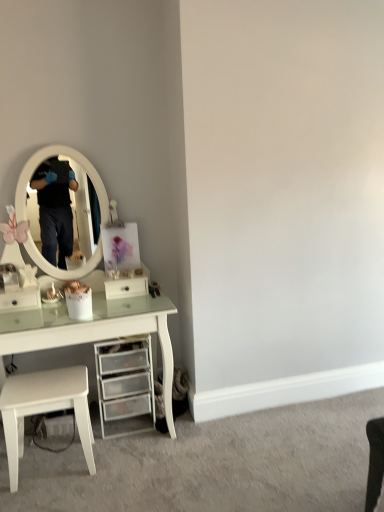
Question: Can you confirm if white glossy drawer at center, the 1th drawer positioned from the right, is thinner than clear plastic drawers at lower center?

Choices:
 (A) no
 (B) yes

Answer: (B)

Question: From a real-world perspective, is white glossy drawer at center, marked as the second drawer in a left-to-right arrangement, under clear plastic drawers at lower center?

Choices:
 (A) yes
 (B) no

Answer: (B)

Question: Considering the relative positions of white glossy drawer at center, marked as the second drawer in a left-to-right arrangement, and clear plastic drawers at lower center in the image provided, is white glossy drawer at center, marked as the second drawer in a left-to-right arrangement, in front of clear plastic drawers at lower center?

Choices:
 (A) yes
 (B) no

Answer: (B)

Question: Is clear plastic drawers at lower center at the back of white glossy drawer at center, the 1th drawer positioned from the right?

Choices:
 (A) yes
 (B) no

Answer: (B)

Question: Is white glossy drawer at center, marked as the second drawer in a left-to-right arrangement, not inside clear plastic drawers at lower center?

Choices:
 (A) no
 (B) yes

Answer: (B)

Question: Choose the correct answer: Is clear plastic drawers at lower center inside white matte stool at lower left or outside it?

Choices:
 (A) outside
 (B) inside

Answer: (A)

Question: From the image's perspective, relative to white matte stool at lower left, is clear plastic drawers at lower center above or below?

Choices:
 (A) below
 (B) above

Answer: (B)

Question: In terms of size, does clear plastic drawers at lower center appear bigger or smaller than white matte stool at lower left?

Choices:
 (A) small
 (B) big

Answer: (B)

Question: In terms of height, does clear plastic drawers at lower center look taller or shorter compared to white matte stool at lower left?

Choices:
 (A) short
 (B) tall

Answer: (B)

Question: Would you say white glossy drawer at left, which is the first drawer in left-to-right order, is inside or outside white glossy drawer at center, the 1th drawer positioned from the right?

Choices:
 (A) inside
 (B) outside

Answer: (B)

Question: Based on their sizes in the image, would you say white glossy drawer at left, which appears as the 2th drawer when viewed from the right, is bigger or smaller than white glossy drawer at center, marked as the second drawer in a left-to-right arrangement?

Choices:
 (A) small
 (B) big

Answer: (B)

Question: Considering the positions of white glossy drawer at left, which appears as the 2th drawer when viewed from the right, and white glossy drawer at center, the 1th drawer positioned from the right, in the image, is white glossy drawer at left, which appears as the 2th drawer when viewed from the right, taller or shorter than white glossy drawer at center, the 1th drawer positioned from the right,?

Choices:
 (A) short
 (B) tall

Answer: (B)

Question: Considering their positions, is white glossy drawer at left, which is the first drawer in left-to-right order, located in front of or behind white glossy drawer at center, the 1th drawer positioned from the right?

Choices:
 (A) front
 (B) behind

Answer: (A)

Question: Considering their positions, is white matte stool at lower left located in front of or behind white glossy drawer at center, marked as the second drawer in a left-to-right arrangement?

Choices:
 (A) front
 (B) behind

Answer: (A)

Question: Is point (28, 415) closer or farther from the camera than point (124, 287)?

Choices:
 (A) closer
 (B) farther

Answer: (A)